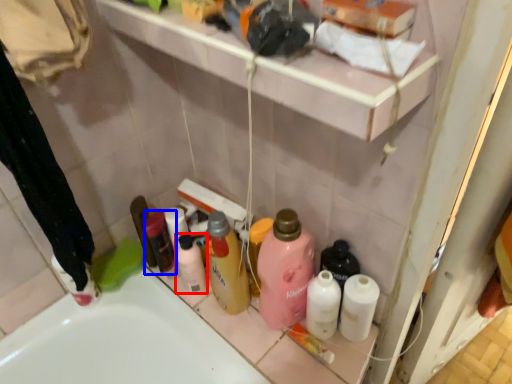
Question: Among these objects, which one is farthest to the camera, toiletry (highlighted by a red box) or toiletry (highlighted by a blue box)?

Choices:
 (A) toiletry
 (B) toiletry

Answer: (B)